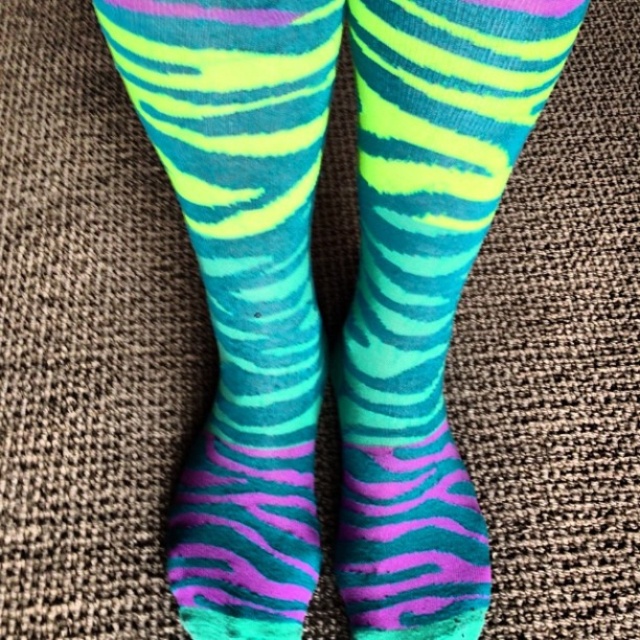
Question: Among these objects, which one is farthest from the camera?

Choices:
 (A) neon zebra socks at center
 (B) neon zebra-patterned socks at center

Answer: (B)

Question: Which object appears farthest from the camera in this image?

Choices:
 (A) neon zebra socks at center
 (B) neon zebra-patterned socks at center

Answer: (B)

Question: Is neon zebra socks at center thinner than neon zebra-patterned socks at center?

Choices:
 (A) no
 (B) yes

Answer: (A)

Question: Is neon zebra socks at center above neon zebra-patterned socks at center?

Choices:
 (A) yes
 (B) no

Answer: (B)

Question: Which point is farther to the camera?

Choices:
 (A) (156, 83)
 (B) (410, 577)

Answer: (B)

Question: Is neon zebra socks at center to the left of neon zebra-patterned socks at center from the viewer's perspective?

Choices:
 (A) yes
 (B) no

Answer: (A)